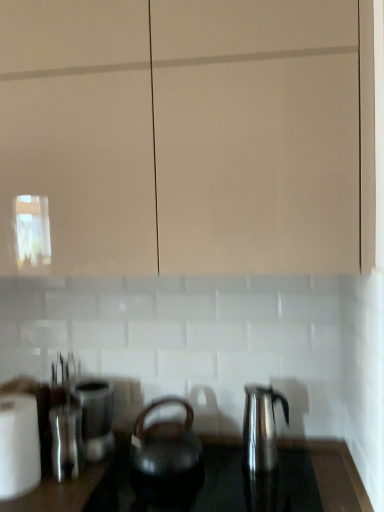
Question: Does transparent glass cabinet at upper center appear on the left side of black matte kettle at center, the first kettle when ordered from left to right?

Choices:
 (A) yes
 (B) no

Answer: (A)

Question: Is transparent glass cabinet at upper center closer to the viewer compared to black matte kettle at center, positioned as the 2th kettle in right-to-left order?

Choices:
 (A) no
 (B) yes

Answer: (B)

Question: From the image's perspective, is transparent glass cabinet at upper center located above black matte kettle at center, positioned as the 2th kettle in right-to-left order?

Choices:
 (A) no
 (B) yes

Answer: (B)

Question: Considering the relative sizes of transparent glass cabinet at upper center and black matte kettle at center, positioned as the 2th kettle in right-to-left order, in the image provided, is transparent glass cabinet at upper center smaller than black matte kettle at center, positioned as the 2th kettle in right-to-left order,?

Choices:
 (A) yes
 (B) no

Answer: (B)

Question: Is transparent glass cabinet at upper center oriented towards black matte kettle at center, positioned as the 2th kettle in right-to-left order?

Choices:
 (A) no
 (B) yes

Answer: (A)

Question: Considering the positions of satin silver canister at left, the second appliance from the front, and shiny black kettle at center in the image, is satin silver canister at left, the second appliance from the front, bigger or smaller than shiny black kettle at center?

Choices:
 (A) small
 (B) big

Answer: (A)

Question: From the image's perspective, is satin silver canister at left, which ranks as the first appliance in back-to-front order, located above or below shiny black kettle at center?

Choices:
 (A) below
 (B) above

Answer: (B)

Question: In terms of height, does satin silver canister at left, which ranks as the first appliance in back-to-front order, look taller or shorter compared to shiny black kettle at center?

Choices:
 (A) short
 (B) tall

Answer: (B)

Question: Relative to shiny black kettle at center, is satin silver canister at left, the second appliance from the front, in front or behind?

Choices:
 (A) front
 (B) behind

Answer: (B)

Question: From a real-world perspective, is satin silver canister at left, which ranks as the first appliance in back-to-front order, above or below transparent glass cabinet at upper center?

Choices:
 (A) below
 (B) above

Answer: (A)

Question: Would you say satin silver canister at left, the second appliance from the front, is inside or outside transparent glass cabinet at upper center?

Choices:
 (A) outside
 (B) inside

Answer: (A)

Question: In terms of width, does satin silver canister at left, the second appliance from the front, look wider or thinner when compared to transparent glass cabinet at upper center?

Choices:
 (A) thin
 (B) wide

Answer: (A)

Question: Relative to transparent glass cabinet at upper center, is satin silver canister at left, which ranks as the first appliance in back-to-front order, in front or behind?

Choices:
 (A) front
 (B) behind

Answer: (B)

Question: Choose the correct answer: Is satin silver canister at left, the second appliance from the front, inside shiny metallic kettle at right, positioned as the second kettle in left-to-right order, or outside it?

Choices:
 (A) inside
 (B) outside

Answer: (B)

Question: From a real-world perspective, is satin silver canister at left, which ranks as the first appliance in back-to-front order, physically located above or below shiny metallic kettle at right, the first kettle positioned from the right?

Choices:
 (A) above
 (B) below

Answer: (B)